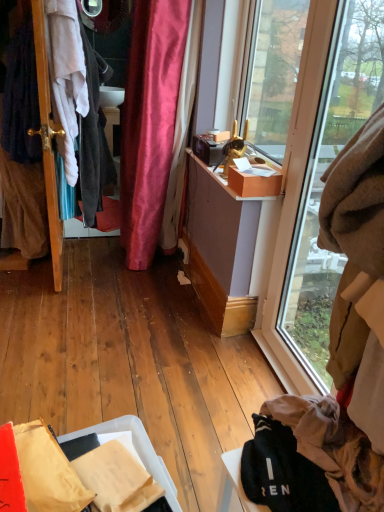
Question: From a real-world perspective, is matte brown box at upper right located beneath matte cardboard box at upper right?

Choices:
 (A) yes
 (B) no

Answer: (B)

Question: Is matte brown box at upper right at the right side of matte cardboard box at upper right?

Choices:
 (A) yes
 (B) no

Answer: (A)

Question: Are matte brown box at upper right and matte cardboard box at upper right far apart?

Choices:
 (A) yes
 (B) no

Answer: (B)

Question: Can you confirm if matte brown box at upper right is shorter than matte cardboard box at upper right?

Choices:
 (A) yes
 (B) no

Answer: (B)

Question: From the image's perspective, is matte brown box at upper right located above matte cardboard box at upper right?

Choices:
 (A) no
 (B) yes

Answer: (B)

Question: Is matte brown box at upper right positioned behind matte cardboard box at upper right?

Choices:
 (A) no
 (B) yes

Answer: (A)

Question: Does brown fuzzy blanket at upper right, the second clothing from the top, have a lesser height compared to matte cardboard box at upper right?

Choices:
 (A) no
 (B) yes

Answer: (A)

Question: Is there a large distance between brown fuzzy blanket at upper right, which is the first clothing from right to left, and matte cardboard box at upper right?

Choices:
 (A) no
 (B) yes

Answer: (A)

Question: From the image's perspective, is brown fuzzy blanket at upper right, which is the first clothing from right to left, under matte cardboard box at upper right?

Choices:
 (A) yes
 (B) no

Answer: (A)

Question: Is brown fuzzy blanket at upper right, which is the first clothing from right to left, smaller than matte cardboard box at upper right?

Choices:
 (A) yes
 (B) no

Answer: (B)

Question: Is brown fuzzy blanket at upper right, the 1th clothing when ordered from bottom to top, at the left side of matte cardboard box at upper right?

Choices:
 (A) yes
 (B) no

Answer: (B)

Question: Is brown fuzzy blanket at upper right, the 2th clothing positioned from the back, further to camera compared to matte cardboard box at upper right?

Choices:
 (A) yes
 (B) no

Answer: (B)

Question: From a real-world perspective, is clear glass window at right positioned over wooden door at left based on gravity?

Choices:
 (A) no
 (B) yes

Answer: (B)